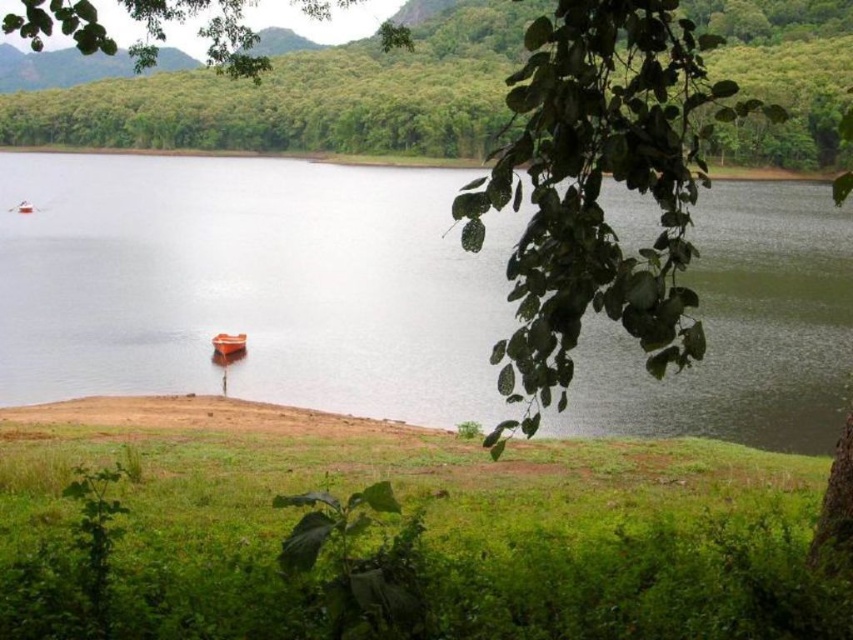
Based on the photo, you are a photographer planning to capture the orange matte boat at center and the clear water at center in a single shot. Based on their sizes in the scene, which object should you focus on first to ensure both are in frame?

The clear water at center is bigger than the orange matte boat at center, so you should focus on the clear water at center first to ensure both are in frame.

You are standing at the lakeside and see the green grass at lower center and the green leafy tree at upper center. Which object is closer to your feet?

The green grass at lower center is closer to your feet since it is positioned below the green leafy tree at upper center.

You are standing at the lakeside and want to take a photo that includes both the green grass at lower center and the green leafy tree at upper center. Which object should you focus on first if you want to ensure both are in the frame?

You should focus on the green leafy tree at upper center first because it is larger than the green grass at lower center, ensuring it fits within the frame while still capturing the smaller grass area.